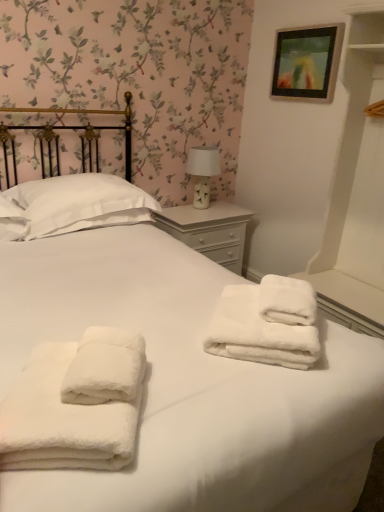
This screenshot has width=384, height=512. In order to click on vacant area situated below white ceramic table lamp at upper right (from a real-world perspective) in this screenshot , I will do `click(211, 207)`.